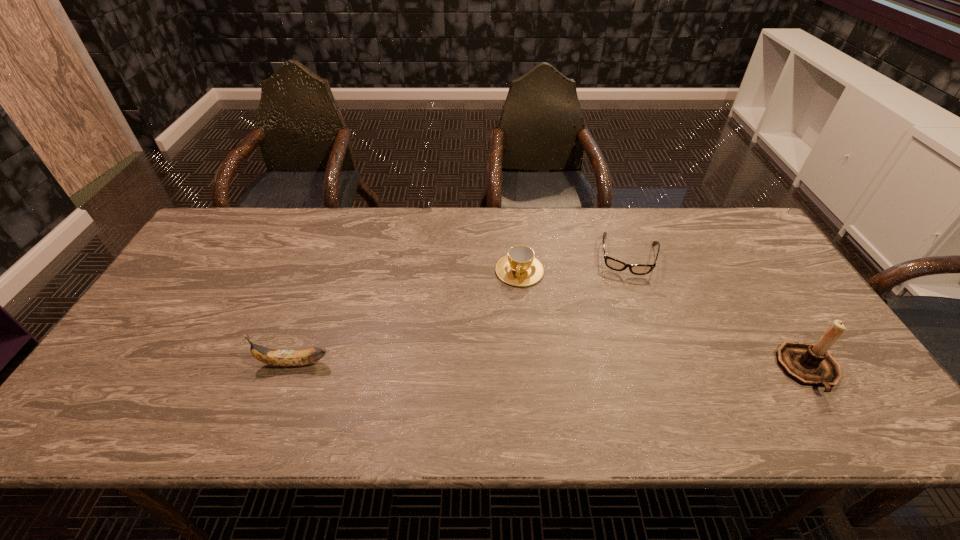
What are the coordinates of `vacant space that's between the tallest object and the banana` in the screenshot? It's located at (551, 367).

You are a GUI agent. You are given a task and a screenshot of the screen. Output one action in this format:
    pyautogui.click(x=<x>, y=<y>)
    Task: Click on the free point between the third object from right to left and the shortest object
    
    Given the screenshot: What is the action you would take?
    pyautogui.click(x=574, y=263)

At what (x,y) coordinates should I click in order to perform the action: click on vacant point located between the cup and the tallest object. Please return your answer as a coordinate pair (x, y). Looking at the image, I should click on (664, 320).

Where is `free space between the banana and the third object from left to right`? The image size is (960, 540). free space between the banana and the third object from left to right is located at coordinates (461, 309).

At what (x,y) coordinates should I click in order to perform the action: click on vacant region between the spectacles and the third object from right to left. Please return your answer as a coordinate pair (x, y). The image size is (960, 540). Looking at the image, I should click on (574, 263).

Where is `vacant area between the rightmost object and the cup`? vacant area between the rightmost object and the cup is located at coordinates (664, 320).

Image resolution: width=960 pixels, height=540 pixels. In order to click on empty location between the cup and the third object from left to right in this screenshot , I will do `click(574, 263)`.

Identify which object is the closest to the cup. Please provide its 2D coordinates. Your answer should be formatted as a tuple, i.e. [(x, y)], where the tuple contains the x and y coordinates of a point satisfying the conditions above.

[(637, 269)]

Identify the location of object that is the closest one to the banana. (519, 267).

I want to click on vacant area that satisfies the following two spatial constraints: 1. on the back side of the shortest object; 2. on the right side of the cup, so click(518, 255).